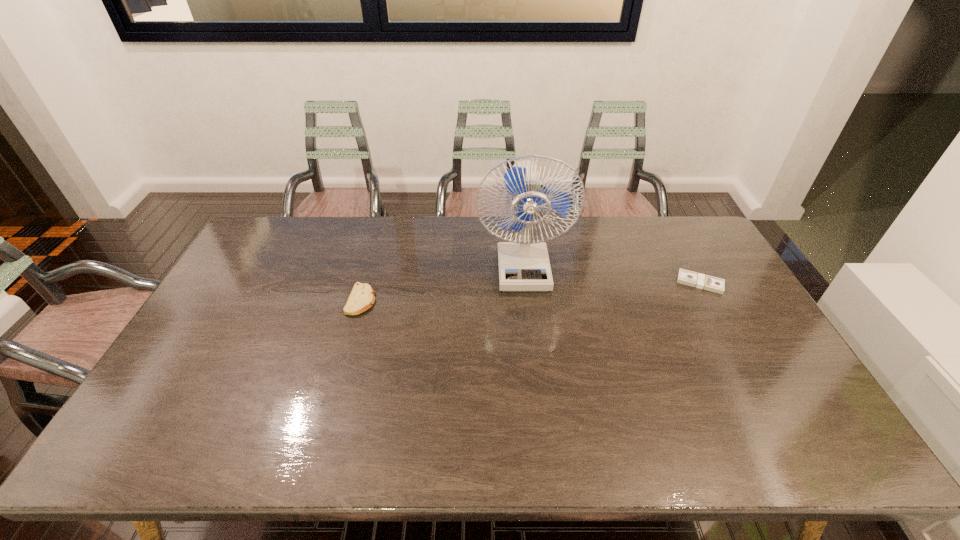
Where is `blank area in the image that satisfies the following two spatial constraints: 1. on the front-facing side of the tallest object; 2. on the right side of the shortest object`? The width and height of the screenshot is (960, 540). blank area in the image that satisfies the following two spatial constraints: 1. on the front-facing side of the tallest object; 2. on the right side of the shortest object is located at coordinates (524, 283).

Where is `vacant area in the image that satisfies the following two spatial constraints: 1. on the front-facing side of the tallest object; 2. on the right side of the rightmost object`? Image resolution: width=960 pixels, height=540 pixels. vacant area in the image that satisfies the following two spatial constraints: 1. on the front-facing side of the tallest object; 2. on the right side of the rightmost object is located at coordinates (524, 283).